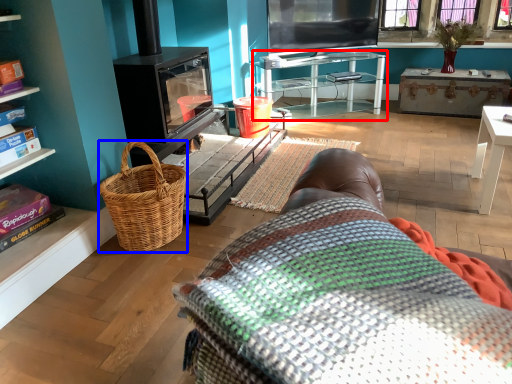
Question: Which point is further to the camera, table (highlighted by a red box) or picnic basket (highlighted by a blue box)?

Choices:
 (A) table
 (B) picnic basket

Answer: (A)